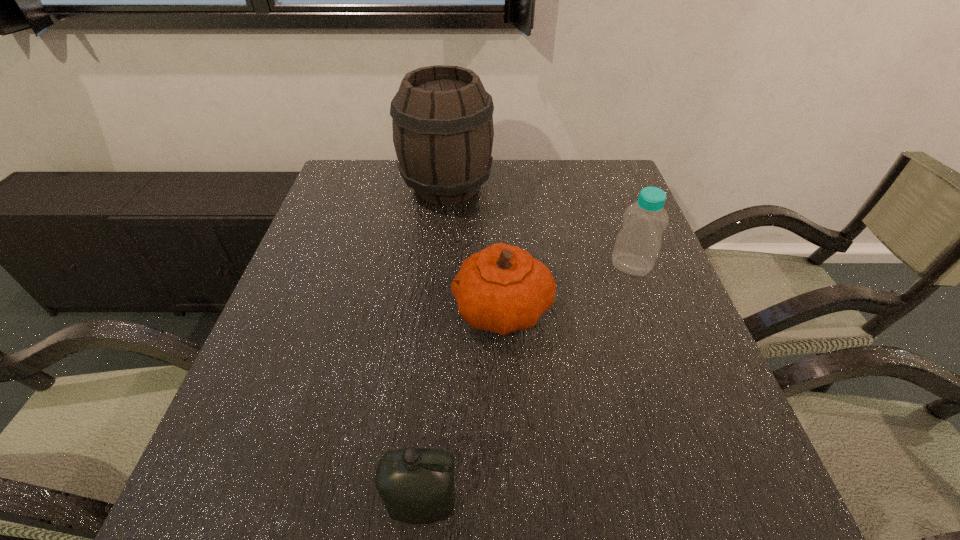
I want to click on wine bucket, so click(x=443, y=132).

Where is `the farthest object`? Image resolution: width=960 pixels, height=540 pixels. the farthest object is located at coordinates (443, 132).

At what (x,y) coordinates should I click in order to perform the action: click on the taller bottle. Please return your answer as a coordinate pair (x, y). The height and width of the screenshot is (540, 960). Looking at the image, I should click on (637, 245).

The height and width of the screenshot is (540, 960). I want to click on the right bottle, so click(637, 245).

Find the location of `pumpkin`. pumpkin is located at coordinates (502, 288).

Locate an element on the screen. the nearer bottle is located at coordinates (416, 485).

This screenshot has width=960, height=540. What are the coordinates of `the left bottle` in the screenshot? It's located at (416, 485).

Find the location of a particular element. free space located on the left of the tallest object is located at coordinates (378, 186).

Locate an element on the screen. This screenshot has width=960, height=540. free space located on the left of the second tallest object is located at coordinates (570, 265).

The height and width of the screenshot is (540, 960). I want to click on free space located on the front-facing side of the pumpkin, so click(x=346, y=309).